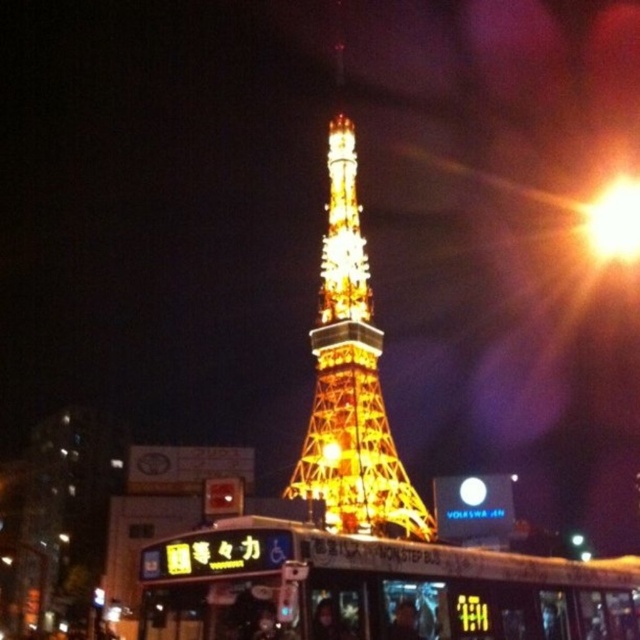
The height and width of the screenshot is (640, 640). Identify the location of bright yellow light at upper right. (612, 221).

Which is in front, point (609, 230) or point (326, 460)?

Point (326, 460)

Does point (614, 208) come farther from viewer compared to point (323, 445)?

Yes, it is behind point (323, 445).

What are the coordinates of `bright yellow light at upper right` in the screenshot? It's located at (612, 221).

Which is in front, point (353, 170) or point (632, 204)?

Positioned in front is point (353, 170).

Between point (406, 486) and point (634, 260), which one is positioned behind?

The point (634, 260) is more distant.

Is point (333, 179) less distant than point (632, 177)?

Yes, it is.

Where is `gold metallic tower at center`? The height and width of the screenshot is (640, 640). gold metallic tower at center is located at coordinates (349, 372).

Can you confirm if metallic gold bus at center is wider than bright yellow light at upper right?

Yes, metallic gold bus at center is wider than bright yellow light at upper right.

Does metallic gold bus at center appear on the left side of bright yellow light at upper right?

Indeed, metallic gold bus at center is positioned on the left side of bright yellow light at upper right.

Between point (404, 557) and point (637, 259), which one is positioned in front?

Point (404, 557) is in front.

Image resolution: width=640 pixels, height=640 pixels. Find the location of `metallic gold bus at center`. metallic gold bus at center is located at coordinates (372, 588).